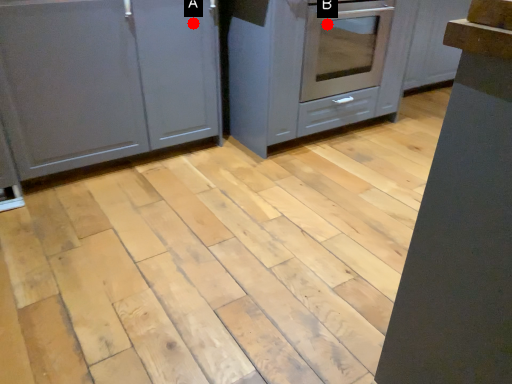
Question: Two points are circled on the image, labeled by A and B beside each circle. Which point is closer to the camera?

Choices:
 (A) A is closer
 (B) B is closer

Answer: (A)